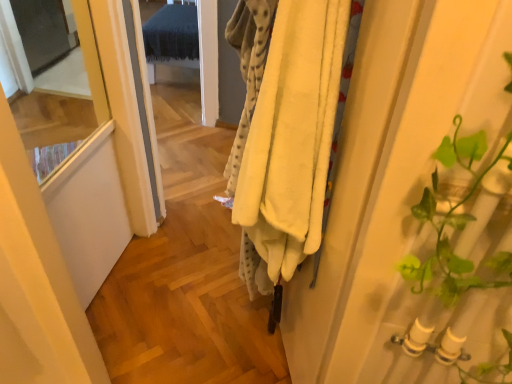
Question: Is transparent glass screen door at upper left situated inside soft yellow fleece blanket at center or outside?

Choices:
 (A) inside
 (B) outside

Answer: (B)

Question: In terms of width, does transparent glass screen door at upper left look wider or thinner when compared to soft yellow fleece blanket at center?

Choices:
 (A) thin
 (B) wide

Answer: (B)

Question: Does point (39, 61) appear closer or farther from the camera than point (304, 243)?

Choices:
 (A) closer
 (B) farther

Answer: (B)

Question: From their relative heights in the image, would you say soft yellow fleece blanket at center is taller or shorter than transparent glass screen door at upper left?

Choices:
 (A) tall
 (B) short

Answer: (A)

Question: Is soft yellow fleece blanket at center spatially inside transparent glass screen door at upper left, or outside of it?

Choices:
 (A) outside
 (B) inside

Answer: (A)

Question: Is point (251, 246) positioned closer to the camera than point (54, 46)?

Choices:
 (A) farther
 (B) closer

Answer: (B)

Question: Considering their positions, is soft yellow fleece blanket at center located in front of or behind transparent glass screen door at upper left?

Choices:
 (A) front
 (B) behind

Answer: (A)